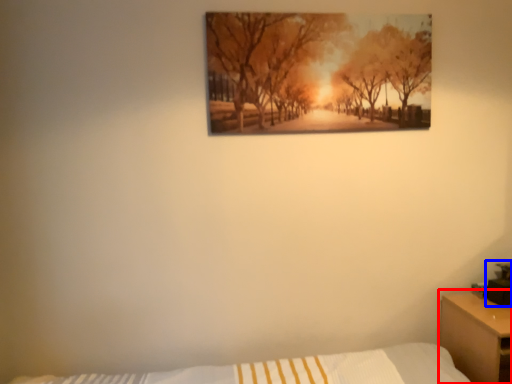
Question: Which point is further to the camera, nightstand (highlighted by a red box) or table lamp (highlighted by a blue box)?

Choices:
 (A) nightstand
 (B) table lamp

Answer: (B)